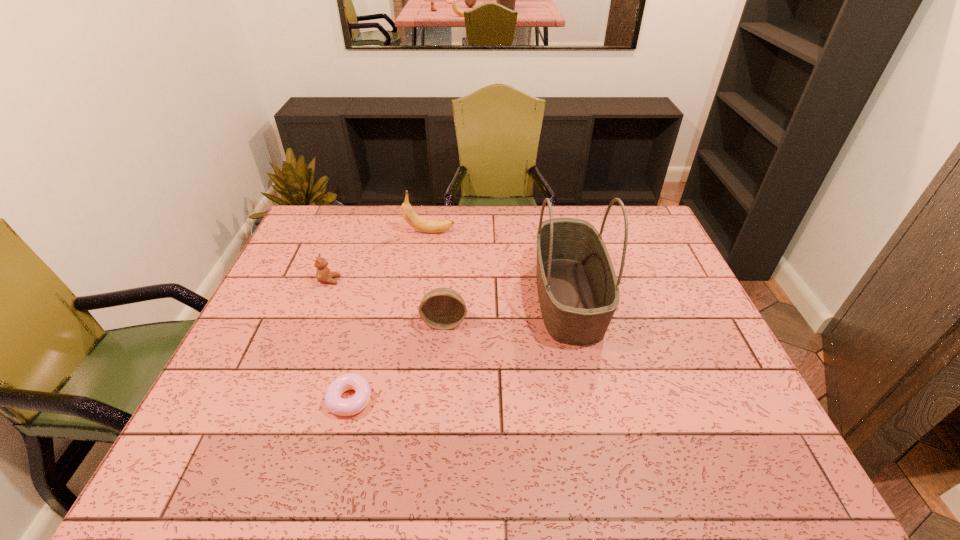
Where is `the rightmost object`? Image resolution: width=960 pixels, height=540 pixels. the rightmost object is located at coordinates (578, 291).

Identify the location of the tallest object. This screenshot has height=540, width=960. (578, 291).

This screenshot has height=540, width=960. Identify the location of banana. (430, 226).

Find the location of a particular element. The height and width of the screenshot is (540, 960). the second tallest object is located at coordinates (430, 226).

Find the location of a particular element. the third tallest object is located at coordinates (442, 308).

Image resolution: width=960 pixels, height=540 pixels. I want to click on teddy bear, so click(x=323, y=274).

At what (x,y) coordinates should I click in order to perform the action: click on the leftmost object. Please return your answer as a coordinate pair (x, y). The width and height of the screenshot is (960, 540). Looking at the image, I should click on (323, 274).

You are a GUI agent. You are given a task and a screenshot of the screen. Output one action in this format:
    pyautogui.click(x=<x>, y=<y>)
    Task: Click on the nearest object
    Image resolution: width=960 pixels, height=540 pixels.
    Given the screenshot: What is the action you would take?
    pyautogui.click(x=333, y=402)

Where is `the shortest object`? the shortest object is located at coordinates (333, 402).

This screenshot has height=540, width=960. I want to click on free space located 0.270m on the front of the rightmost object, so click(602, 451).